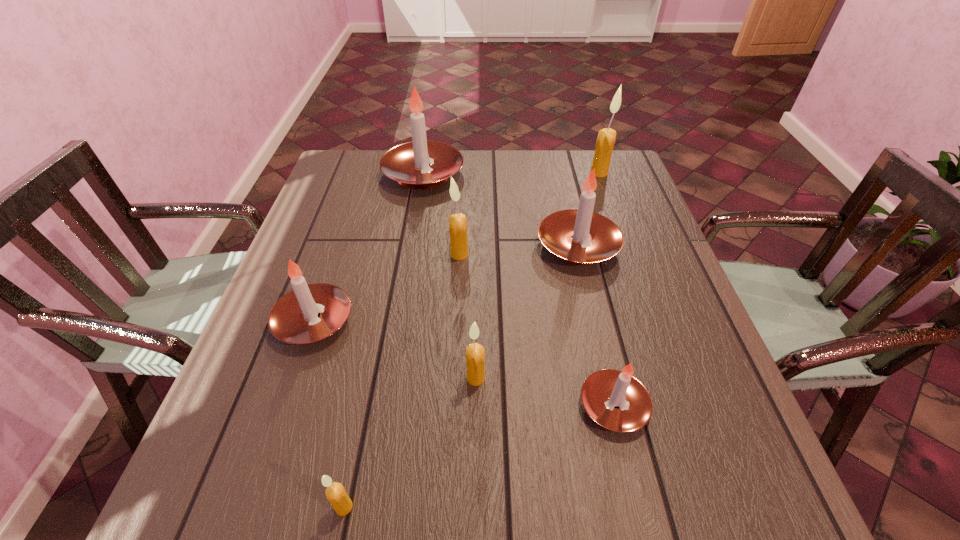
Image resolution: width=960 pixels, height=540 pixels. I want to click on the farthest white candle, so click(x=408, y=163).

Identify the location of the rightmost cream candle. The height and width of the screenshot is (540, 960). (605, 142).

The width and height of the screenshot is (960, 540). In order to click on the biggest cream candle in this screenshot , I will do `click(605, 142)`.

You are a GUI agent. You are given a task and a screenshot of the screen. Output one action in this format:
    pyautogui.click(x=<x>, y=<y>)
    Task: Click on the third smallest white candle
    The height and width of the screenshot is (540, 960).
    Given the screenshot: What is the action you would take?
    pyautogui.click(x=580, y=236)

Locate an element on the screen. The width and height of the screenshot is (960, 540). the second biggest cream candle is located at coordinates (457, 222).

Find the location of a particular element. Image resolution: width=960 pixels, height=540 pixels. the third nearest cream candle is located at coordinates [x=457, y=222].

The width and height of the screenshot is (960, 540). I want to click on the fourth nearest candle, so click(293, 319).

Locate an element on the screen. the fifth farthest object is located at coordinates (293, 319).

In order to click on the third cream candle from left to right in this screenshot , I will do `click(475, 353)`.

At what (x,y) coordinates should I click in order to perform the action: click on the fourth candle from right to left. Please return your answer as a coordinate pair (x, y). The height and width of the screenshot is (540, 960). Looking at the image, I should click on (475, 353).